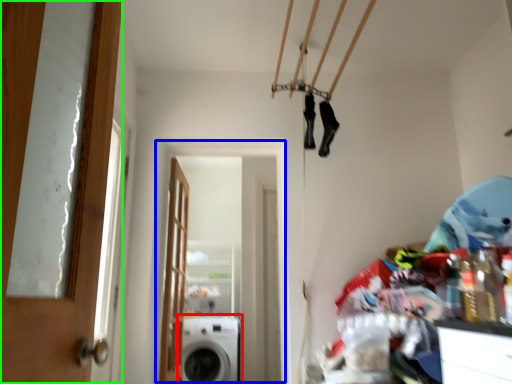
Question: Based on their relative distances, which object is nearer to washing machine (highlighted by a red box)? Choose from screen door (highlighted by a blue box) and door (highlighted by a green box).

Choices:
 (A) screen door
 (B) door

Answer: (A)